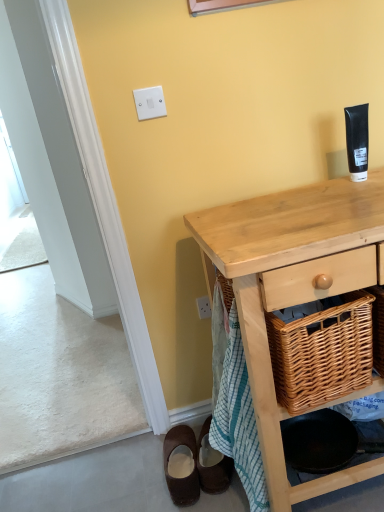
Question: Is natural wood desk at center located outside brown suede mule at lower left, arranged as the 1th footwear when viewed from the left?

Choices:
 (A) no
 (B) yes

Answer: (B)

Question: From the image's perspective, is natural wood desk at center on top of brown suede mule at lower left, the 2th footwear when ordered from right to left?

Choices:
 (A) yes
 (B) no

Answer: (A)

Question: Could brown suede mule at lower left, the 2th footwear when ordered from right to left, be considered to be inside natural wood desk at center?

Choices:
 (A) yes
 (B) no

Answer: (B)

Question: Considering the relative sizes of natural wood desk at center and brown suede mule at lower left, arranged as the 1th footwear when viewed from the left, in the image provided, is natural wood desk at center bigger than brown suede mule at lower left, arranged as the 1th footwear when viewed from the left,?

Choices:
 (A) yes
 (B) no

Answer: (A)

Question: Is natural wood desk at center far away from brown suede mule at lower left, the 2th footwear when ordered from right to left?

Choices:
 (A) yes
 (B) no

Answer: (B)

Question: From a real-world perspective, is natural wood desk at center positioned under brown suede mule at lower left, the 2th footwear when ordered from right to left, based on gravity?

Choices:
 (A) no
 (B) yes

Answer: (A)

Question: From a real-world perspective, is woven wood picnic basket at lower right located beneath white plastic light switch at upper center?

Choices:
 (A) no
 (B) yes

Answer: (B)

Question: Is woven wood picnic basket at lower right further to camera compared to white plastic light switch at upper center?

Choices:
 (A) no
 (B) yes

Answer: (A)

Question: Considering the relative sizes of woven wood picnic basket at lower right and white plastic light switch at upper center in the image provided, is woven wood picnic basket at lower right smaller than white plastic light switch at upper center?

Choices:
 (A) no
 (B) yes

Answer: (A)

Question: Does woven wood picnic basket at lower right have a greater width compared to white plastic light switch at upper center?

Choices:
 (A) yes
 (B) no

Answer: (A)

Question: Is the depth of woven wood picnic basket at lower right less than that of white plastic light switch at upper center?

Choices:
 (A) yes
 (B) no

Answer: (A)

Question: Can you confirm if woven wood picnic basket at lower right is positioned to the right of white plastic light switch at upper center?

Choices:
 (A) no
 (B) yes

Answer: (B)

Question: Can we say brown suede shoes at lower left, the 1th footwear positioned from the right, lies outside brown suede mule at lower left, arranged as the 1th footwear when viewed from the left?

Choices:
 (A) yes
 (B) no

Answer: (A)